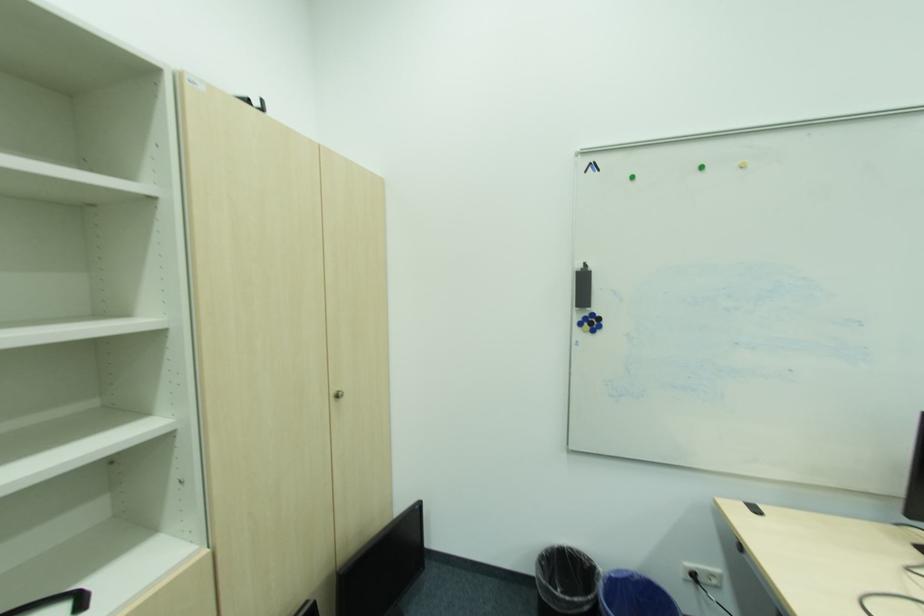
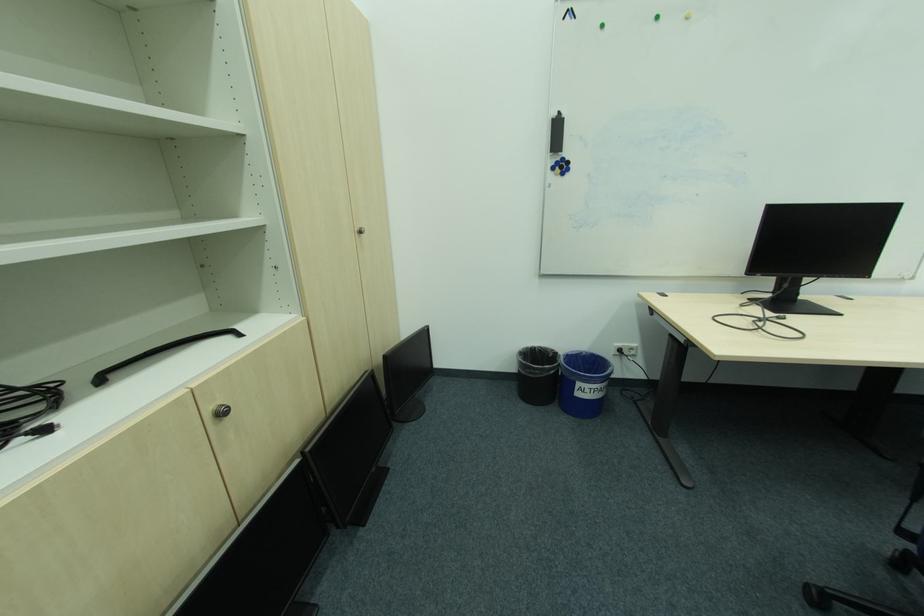
The point at (584,306) is marked in the first image. Where is the corresponding point in the second image?

(558, 152)